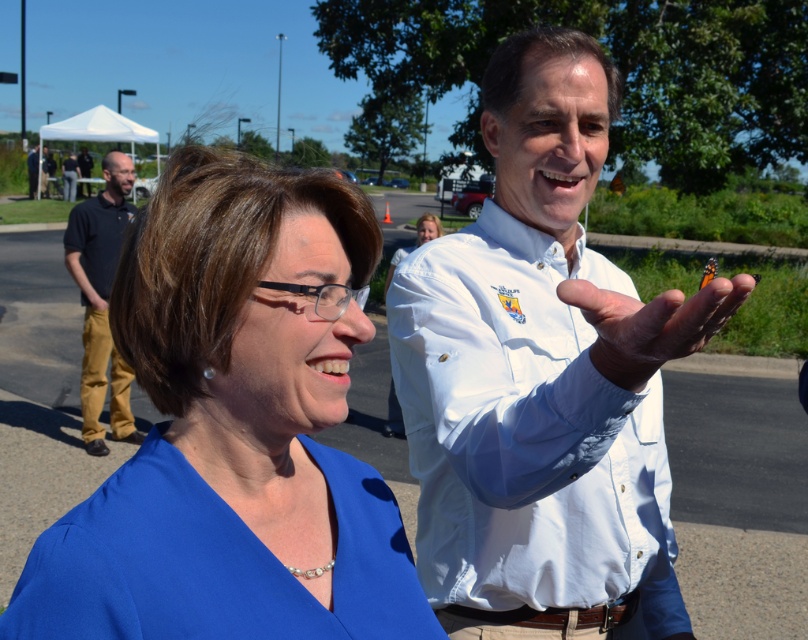
You are a photographer setting up for a group photo. You notice the blue fabric dress at center and the dark blue shirt at left in the scene. Which clothing item is positioned lower in the frame?

The blue fabric dress at center is positioned lower than the dark blue shirt at left in the frame.

You are standing in a park and see two people talking. You notice a dark blue shirt at left and a smooth white hand at center. Which object is positioned to the left of the other?

The dark blue shirt at left is to the left of smooth white hand at center.

You are a photographer trying to capture a photo of the dark blue shirt at left and the man in white shirt on the right. The camera can only focus on objects within a 0.2 unit radius centered at point 0.5, 0.1. Will both subjects be in focus?

The dark blue shirt at left is located at point (x=101, y=300). The man in white shirt on the right is not mentioned in the Objects list, so we cannot determine his position. However, since the dark blue shirt at left is within the 0.2 radius around (x=80, y=320), it will be in focus. The other subject cannot be confirmed without their coordinates.